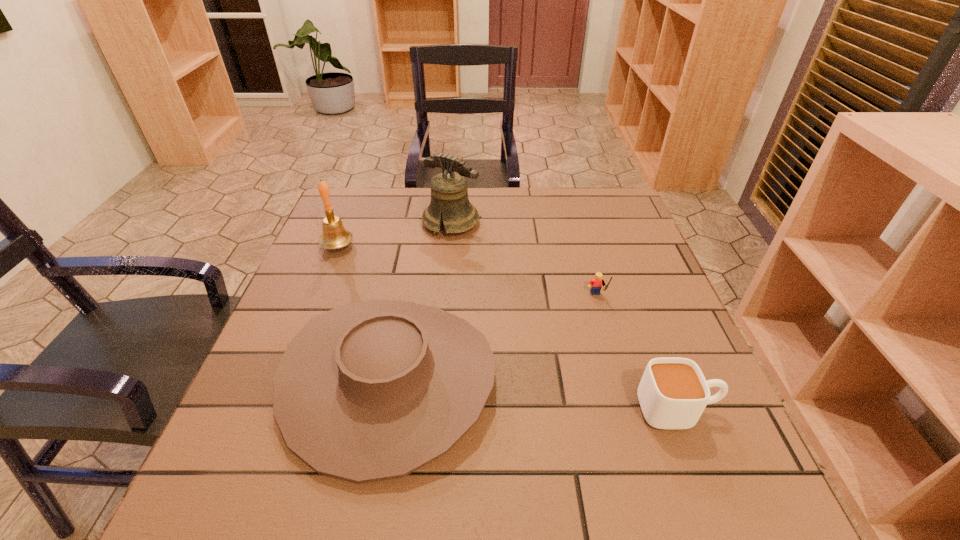
Where is `free space at the far left corner of the desktop`? free space at the far left corner of the desktop is located at coordinates (380, 214).

What are the coordinates of `vacant space at the near left corner of the desktop` in the screenshot? It's located at pyautogui.click(x=217, y=480).

Identify the location of vacant space at the far right corner. (581, 204).

This screenshot has height=540, width=960. Identify the location of vacant space at the near right corner of the desktop. (686, 522).

At what (x,y) coordinates should I click in order to perform the action: click on vacant region between the Lego and the left bell. Please return your answer as a coordinate pair (x, y). This screenshot has width=960, height=540. Looking at the image, I should click on [x=468, y=272].

The image size is (960, 540). In order to click on vacant area that lies between the right bell and the cowboy hat in this screenshot , I will do `click(420, 301)`.

At what (x,y) coordinates should I click in order to perform the action: click on empty space between the Lego and the right bell. Please return your answer as a coordinate pair (x, y). Looking at the image, I should click on (524, 260).

Identify the location of unoccupied area between the Lego and the right bell. (524, 260).

Locate an element on the screen. This screenshot has width=960, height=540. free space between the cowboy hat and the third farthest object is located at coordinates (493, 339).

Find the location of a particular element. The width and height of the screenshot is (960, 540). empty location between the cup and the right bell is located at coordinates (564, 316).